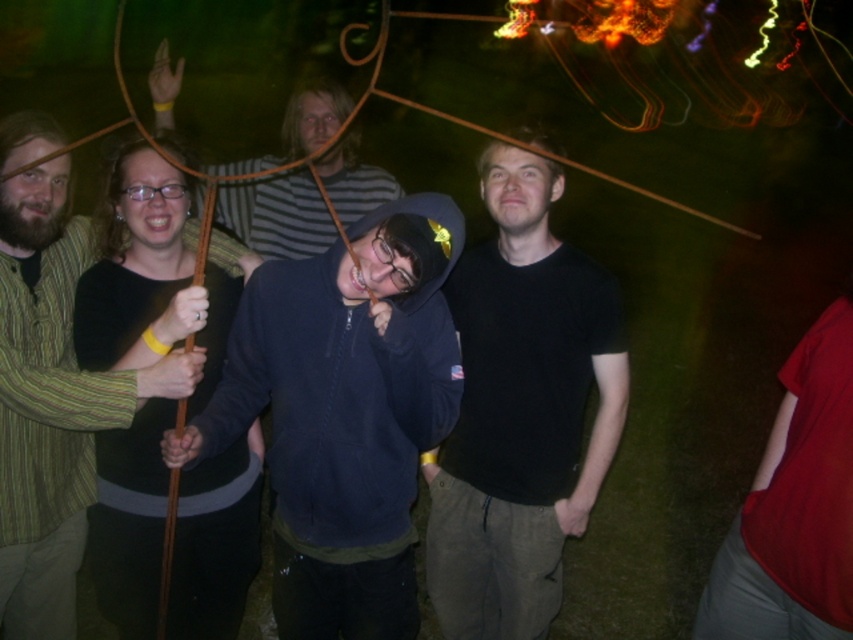
Based on the photo, can you confirm if black matte t-shirt at center is taller than green striped shirt at left?

Yes.

Find the location of a particular element. The height and width of the screenshot is (640, 853). black matte t-shirt at center is located at coordinates (521, 410).

Which is in front, point (457, 570) or point (32, 321)?

Point (32, 321) is more forward.

Find the location of a particular element. The width and height of the screenshot is (853, 640). black matte t-shirt at center is located at coordinates click(521, 410).